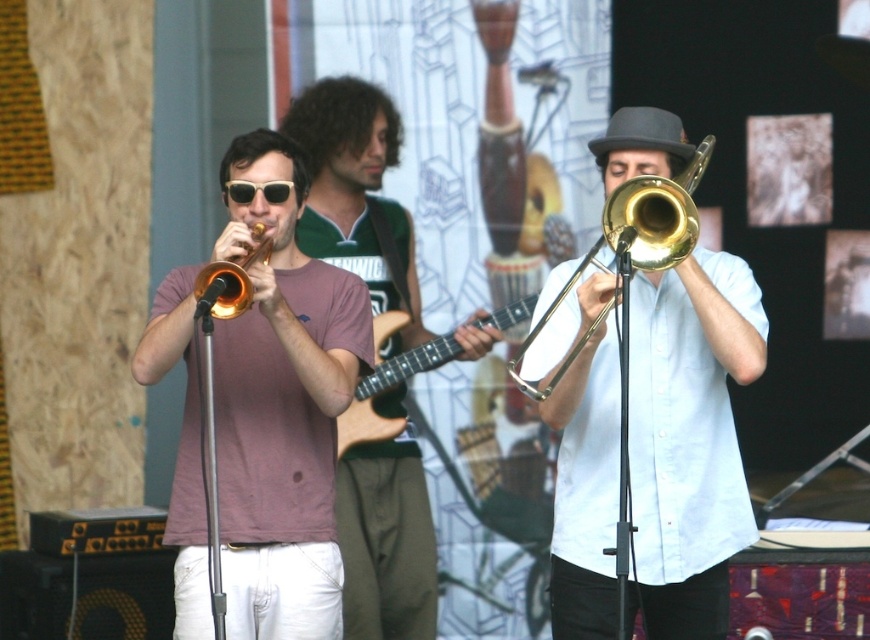
Question: Can you confirm if matte gold trumpet at center is smaller than gold brass trumpet at center?

Choices:
 (A) yes
 (B) no

Answer: (B)

Question: Which of the following is the closest to the observer?

Choices:
 (A) (304, 577)
 (B) (663, 131)
 (C) (666, 216)

Answer: (C)

Question: Which object is the closest to the shiny gold trombone at center?

Choices:
 (A) gold shiny trumpet at left
 (B) black felt fedora at upper right
 (C) matte gold trumpet at center
 (D) matte pink shirt at center

Answer: (B)

Question: Is matte gold trumpet at center to the left of black felt fedora at upper right from the viewer's perspective?

Choices:
 (A) yes
 (B) no

Answer: (A)

Question: Which point is closer to the camera?

Choices:
 (A) shiny gold trombone at center
 (B) black plastic sunglasses at center

Answer: (A)

Question: Does matte gold trumpet at center come in front of black felt fedora at upper right?

Choices:
 (A) yes
 (B) no

Answer: (B)